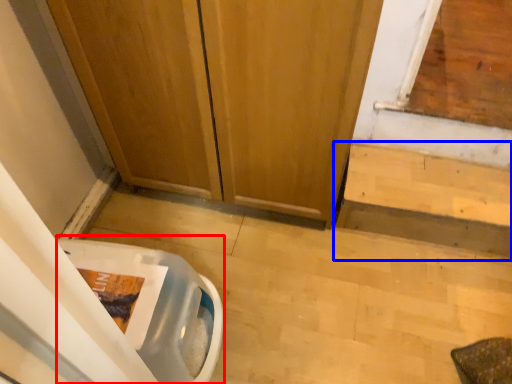
Question: Which of the following is the farthest to the observer, toilet bowl (highlighted by a red box) or stairwell (highlighted by a blue box)?

Choices:
 (A) toilet bowl
 (B) stairwell

Answer: (B)